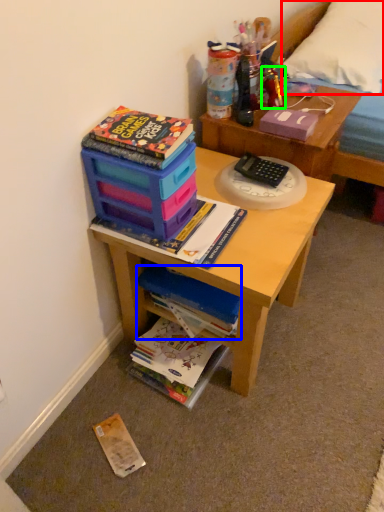
Question: Which is nearer to the pillow (highlighted by a red box)? book (highlighted by a blue box) or toy (highlighted by a green box).

Choices:
 (A) book
 (B) toy

Answer: (B)